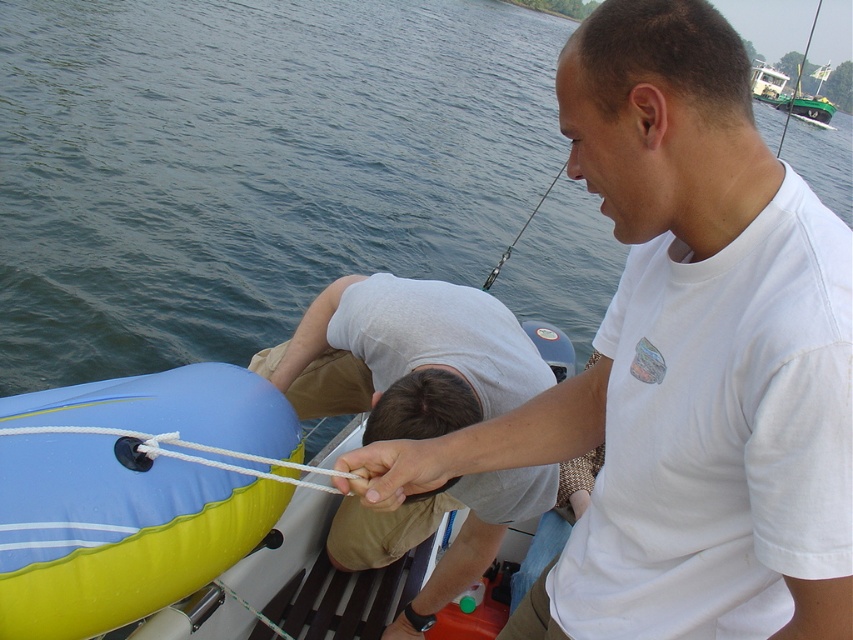
Question: Which point appears farthest from the camera in this image?

Choices:
 (A) (518, 120)
 (B) (827, 74)

Answer: (B)

Question: From the image, what is the correct spatial relationship of white cotton t-shirt at center in relation to white rope at lower left?

Choices:
 (A) above
 (B) below

Answer: (A)

Question: Which point is closer to the camera?

Choices:
 (A) blue rubber boat at lower left
 (B) gray cotton shirt at center

Answer: (B)

Question: Considering the relative positions of white cotton t-shirt at center and white rope at lower left in the image provided, where is white cotton t-shirt at center located with respect to white rope at lower left?

Choices:
 (A) right
 (B) left

Answer: (A)

Question: Which point is closer to the camera taking this photo?

Choices:
 (A) (115, 432)
 (B) (461, 328)
 (C) (770, 86)
 (D) (297, 131)

Answer: (A)

Question: Does white cotton t-shirt at center appear on the left side of white rope at lower left?

Choices:
 (A) no
 (B) yes

Answer: (A)